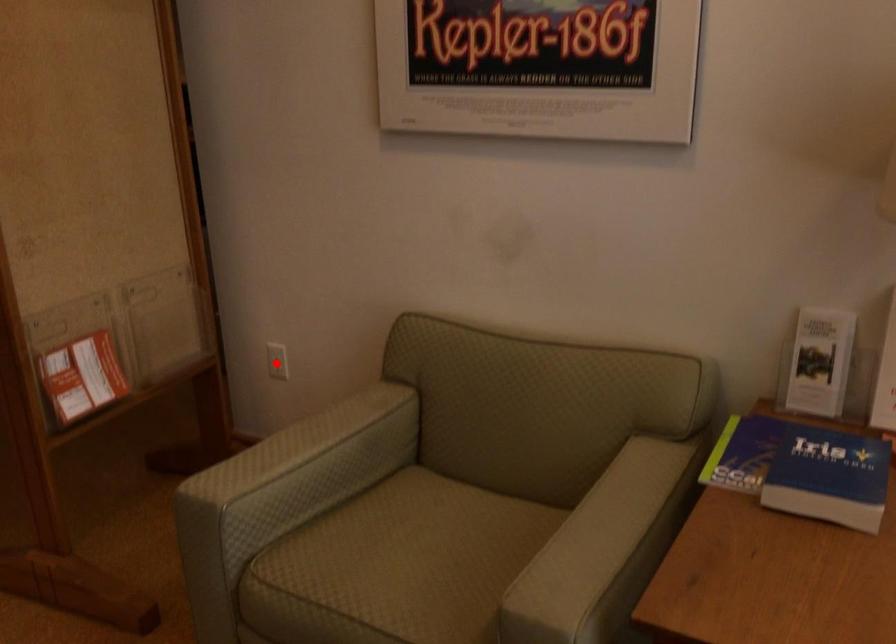
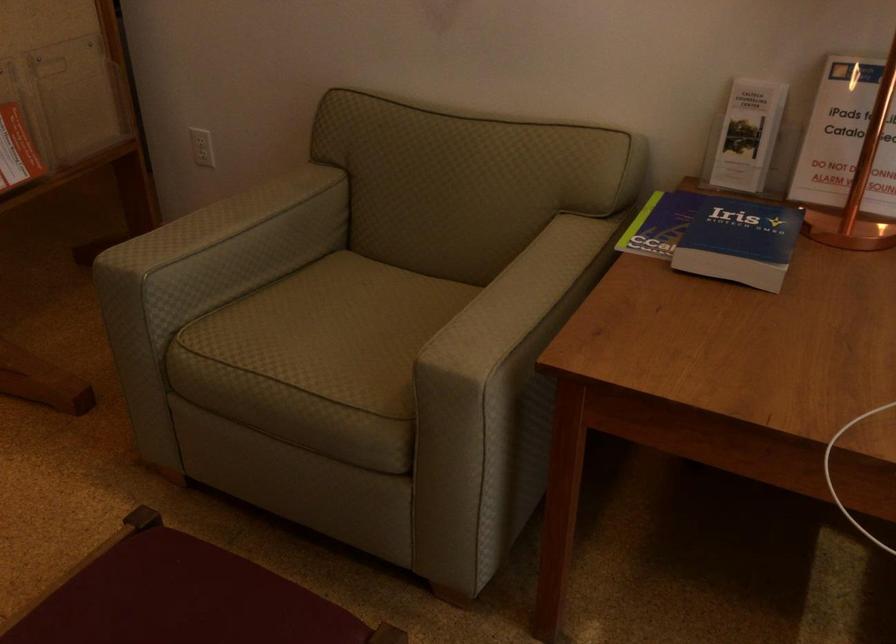
Where in the second image is the point corresponding to the highlighted location from the first image?

(202, 147)